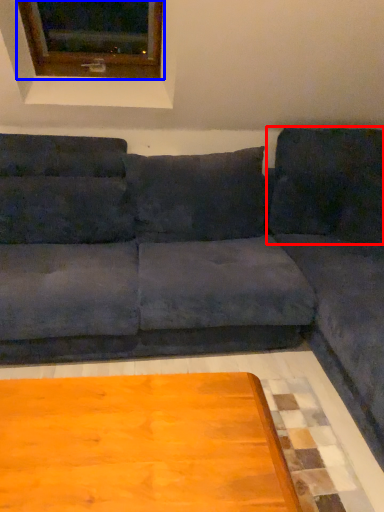
Question: Which of the following is the farthest to the observer, pillow (highlighted by a red box) or window (highlighted by a blue box)?

Choices:
 (A) pillow
 (B) window

Answer: (A)